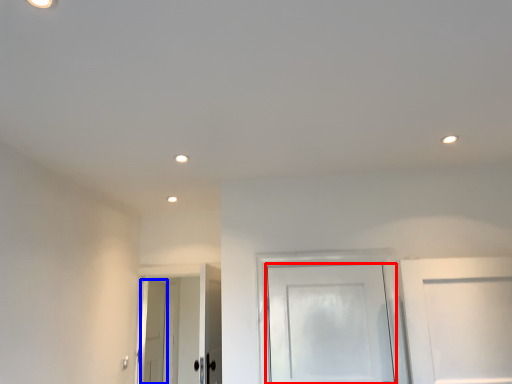
Question: Among these objects, which one is nearest to the camera, door (highlighted by a red box) or door (highlighted by a blue box)?

Choices:
 (A) door
 (B) door

Answer: (A)